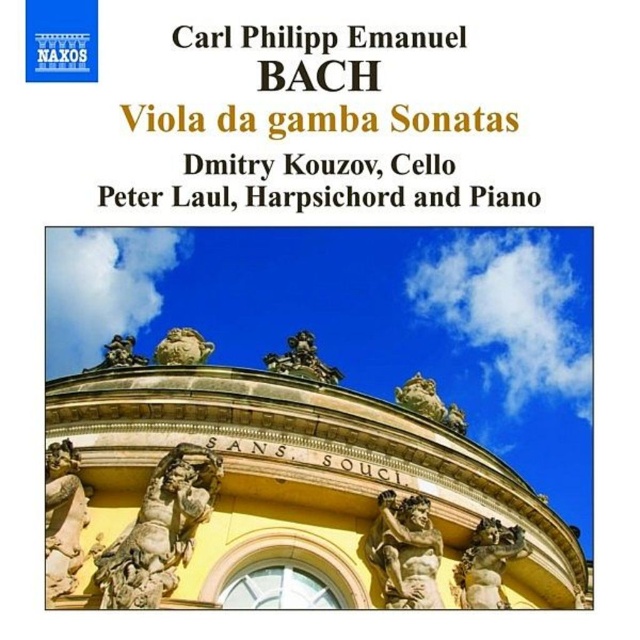
You are an art curator planning to display the bronze statue at center and the gold stone statue at center from the album cover in a gallery. If you want visitors to see both statues clearly, which one should be placed closer to the entrance?

The bronze statue at center should be placed closer to the entrance because it is in front of the gold stone statue at center in the original image, suggesting it should be positioned to maintain visual hierarchy and ensure both are visible.